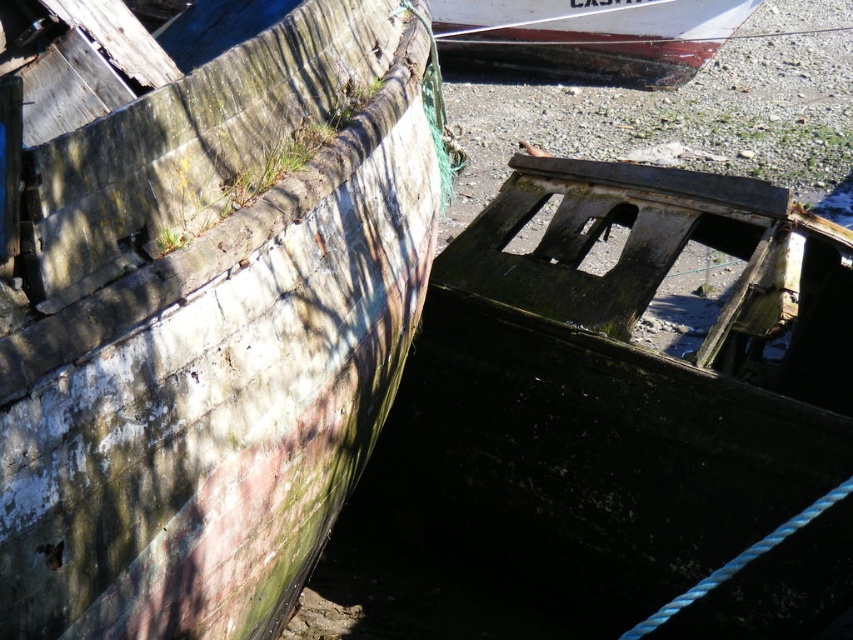
Can you confirm if weathered wood boat at left is shorter than white painted wood boat at upper center?

No.

Which is in front, point (149, 368) or point (613, 32)?

Point (149, 368) is more forward.

Is point (352, 172) farther from camera compared to point (469, 44)?

No, (352, 172) is in front of (469, 44).

Where is `weathered wood boat at left`? weathered wood boat at left is located at coordinates (200, 298).

Between point (142, 476) and point (764, 196), which one is positioned behind?

Point (764, 196)

Describe the element at coordinates (200, 298) in the screenshot. The image size is (853, 640). I see `weathered wood boat at left` at that location.

What are the coordinates of `weathered wood boat at left` in the screenshot? It's located at (200, 298).

Who is positioned more to the left, dark green weathered wood boat at lower right or white painted wood boat at upper center?

Positioned to the left is dark green weathered wood boat at lower right.

Between dark green weathered wood boat at lower right and white painted wood boat at upper center, which one is positioned higher?

white painted wood boat at upper center

Where is `dark green weathered wood boat at lower right`? dark green weathered wood boat at lower right is located at coordinates (643, 394).

You are a GUI agent. You are given a task and a screenshot of the screen. Output one action in this format:
    pyautogui.click(x=<x>, y=<y>)
    Task: Click on the dark green weathered wood boat at lower right
    The image size is (853, 640).
    Given the screenshot: What is the action you would take?
    [643, 394]